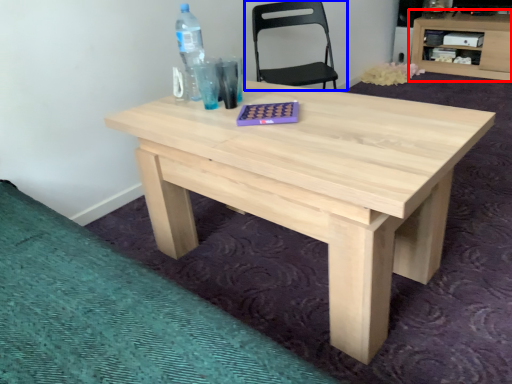
Question: Which of the following is the closest to the observer, computer desk (highlighted by a red box) or chair (highlighted by a blue box)?

Choices:
 (A) computer desk
 (B) chair

Answer: (B)